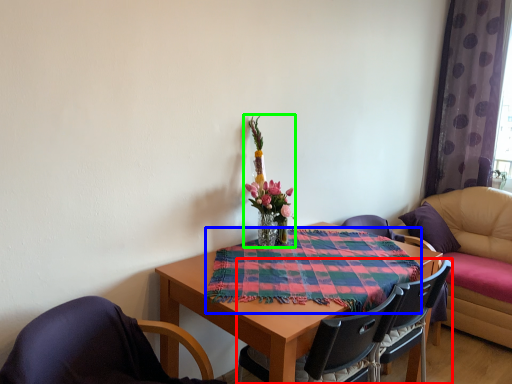
Question: Which object is the closest to the chair (highlighted by a red box)? Choose among these: cloth (highlighted by a blue box) or floral arrangement (highlighted by a green box).

Choices:
 (A) cloth
 (B) floral arrangement

Answer: (A)